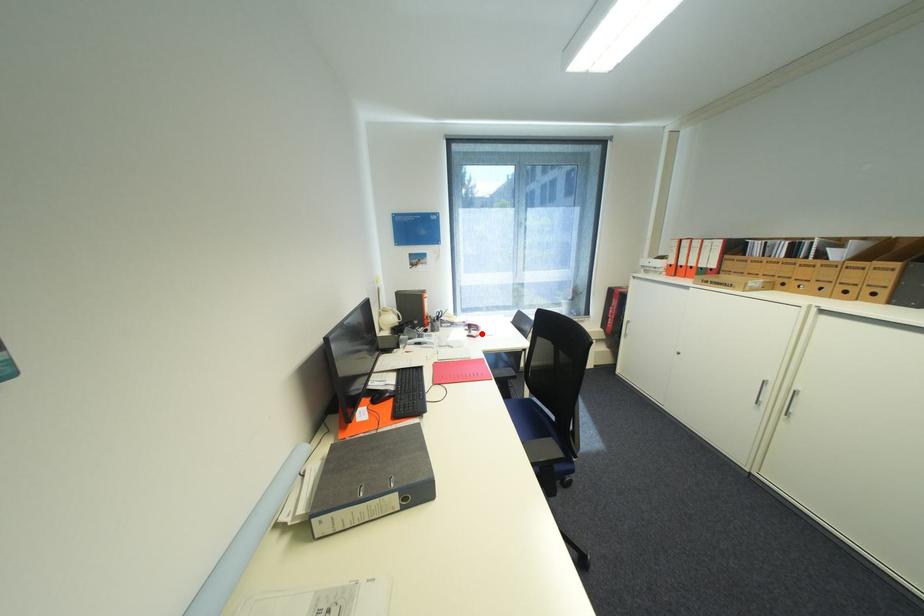
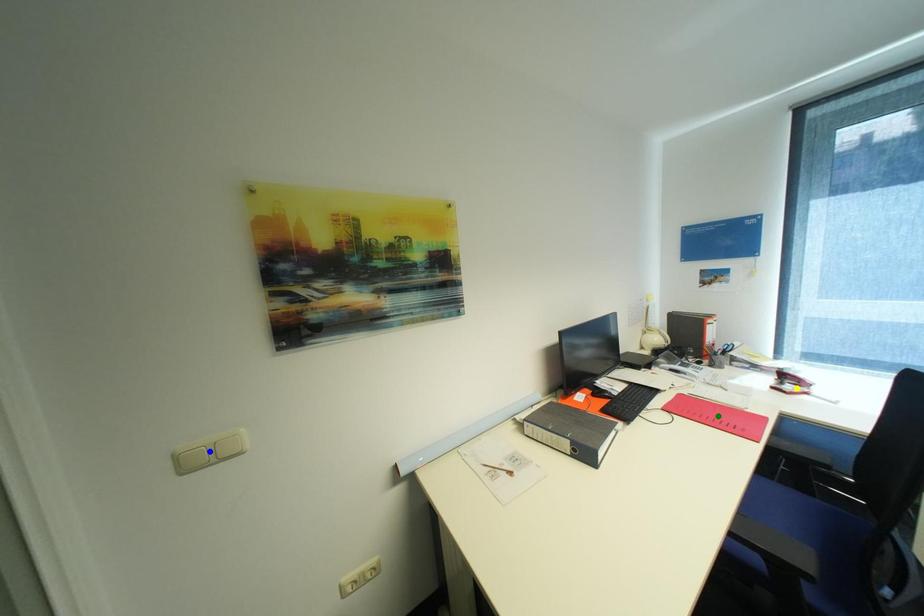
Question: I am providing you with two images of the same scene from different viewpoints. A red point is marked on the first image. You are given multiple points on the second image. Which point in image 2 is actually the same real-world point as the red point in image 1?

Choices:
 (A) blue point
 (B) yellow point
 (C) green point

Answer: (B)